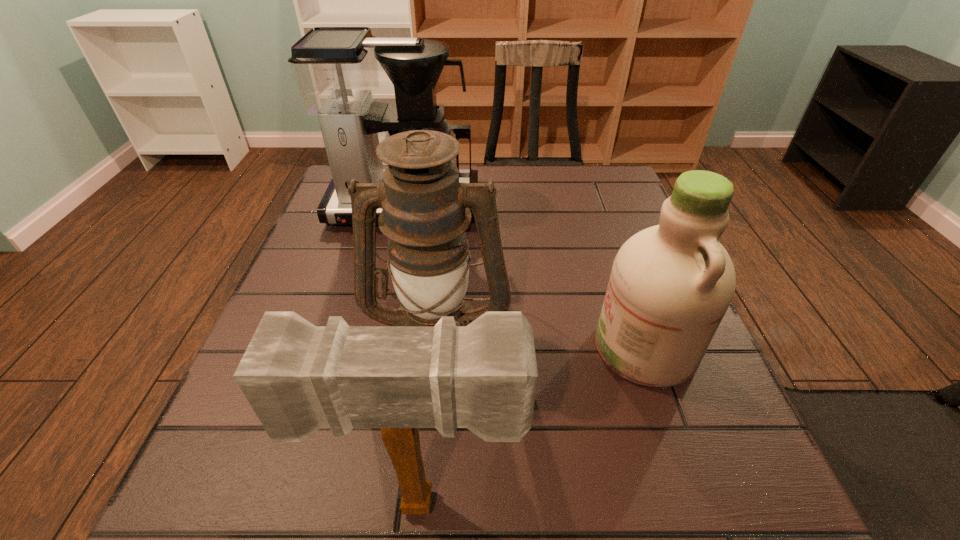
In order to click on vacant position in the image that satisfies the following two spatial constraints: 1. on the front label of the cleansing agent; 2. on the front side of the nearest object in this screenshot , I will do `click(700, 503)`.

The image size is (960, 540). Identify the location of free point that satisfies the following two spatial constraints: 1. at the front of the coffee maker where the controls are located; 2. on the left side of the nearest object. (336, 503).

Image resolution: width=960 pixels, height=540 pixels. What are the coordinates of `vacant space that satisfies the following two spatial constraints: 1. at the front of the coffee maker where the controls are located; 2. on the right side of the mallet` in the screenshot? It's located at (336, 503).